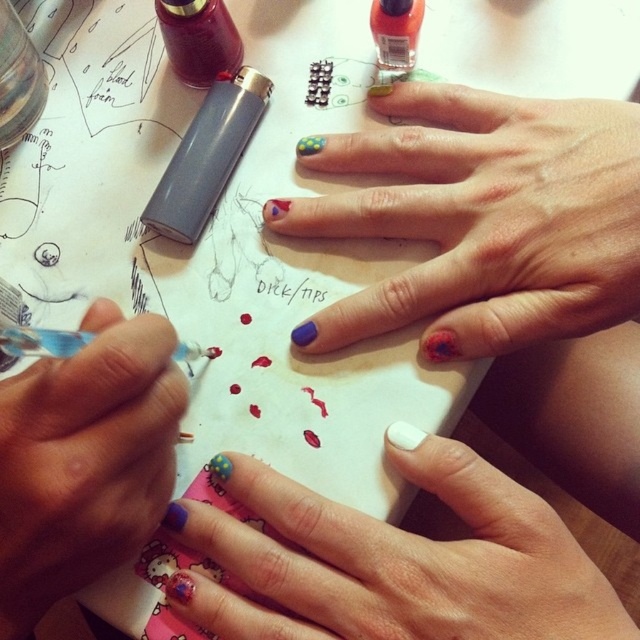
You are an artist trying to place a sticker exactly at the point marked by coordinates point (394, 560). According to the image, what object will the sticker land on?

The point (394, 560) is on matte blue nail polish at center, so the sticker will land on the matte blue nail polish at center.

You are a nail artist who needs to reach for the blue matte nail polish at center and the neon orange glass nail polish at upper center. If your hand can only extend 10 inches, can you comfortably reach both bottles without moving your hand?

The distance between the blue matte nail polish at center and the neon orange glass nail polish at upper center is 11.81 inches, which is beyond the 10 inches your hand can extend. Therefore, you cannot comfortably reach both bottles without moving your hand.